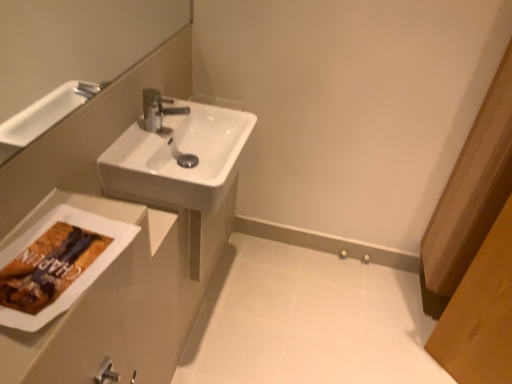
Find the location of a particular element. The width and height of the screenshot is (512, 384). white glossy porcelain at center is located at coordinates (307, 321).

What do you see at coordinates (307, 321) in the screenshot? I see `white glossy porcelain at center` at bounding box center [307, 321].

This screenshot has height=384, width=512. What do you see at coordinates (175, 159) in the screenshot? I see `white glossy sink at center` at bounding box center [175, 159].

Find the location of a particular element. white glossy sink at center is located at coordinates (175, 159).

I want to click on white glossy porcelain at center, so click(307, 321).

Is white glossy porcelain at center to the left of white glossy sink at center from the viewer's perspective?

No.

Is the position of white glossy porcelain at center more distant than that of white glossy sink at center?

Yes, white glossy porcelain at center is further from the camera.

Is point (225, 291) closer to camera compared to point (206, 126)?

No, (225, 291) is further to viewer.

From the image's perspective, between white glossy porcelain at center and white glossy sink at center, which one is located above?

From the image's view, white glossy sink at center is above.

From a real-world perspective, between white glossy porcelain at center and white glossy sink at center, who is vertically lower?

white glossy porcelain at center is physically lower.

Does white glossy porcelain at center have a greater width compared to white glossy sink at center?

Correct, the width of white glossy porcelain at center exceeds that of white glossy sink at center.

Does white glossy porcelain at center have a lesser height compared to white glossy sink at center?

Correct, white glossy porcelain at center is not as tall as white glossy sink at center.

Can you confirm if white glossy porcelain at center is smaller than white glossy sink at center?

Correct, white glossy porcelain at center occupies less space than white glossy sink at center.

From the picture: Would you say white glossy porcelain at center is outside white glossy sink at center?

white glossy porcelain at center is positioned outside white glossy sink at center.

Are white glossy porcelain at center and white glossy sink at center making contact?

There is a gap between white glossy porcelain at center and white glossy sink at center.

Is white glossy sink at center at the back of white glossy porcelain at center?

No, white glossy sink at center is not at the back of white glossy porcelain at center.

Can you tell me how much white glossy porcelain at center and white glossy sink at center differ in facing direction?

There is a 0.961-degree angle between the facing directions of white glossy porcelain at center and white glossy sink at center.

Measure the distance between white glossy porcelain at center and white glossy sink at center.

white glossy porcelain at center is 33.62 inches from white glossy sink at center.

Locate an element on the screen. porcelain directly beneath the white glossy sink at center (from a real-world perspective) is located at coordinates (307, 321).

Consider the image. Is white glossy sink at center to the left or to the right of white glossy porcelain at center in the image?

white glossy sink at center is to the left of white glossy porcelain at center.

Relative to white glossy porcelain at center, is white glossy sink at center in front or behind?

In the image, white glossy sink at center appears in front of white glossy porcelain at center.

Is point (135, 167) less distant than point (214, 286)?

Yes, point (135, 167) is in front of point (214, 286).

From the image's perspective, is white glossy sink at center beneath white glossy porcelain at center?

Incorrect, from the image's perspective, white glossy sink at center is higher than white glossy porcelain at center.

From a real-world perspective, is white glossy sink at center positioned over white glossy porcelain at center based on gravity?

Indeed, from a real-world perspective, white glossy sink at center stands above white glossy porcelain at center.

Does white glossy sink at center have a lesser width compared to white glossy porcelain at center?

Correct, the width of white glossy sink at center is less than that of white glossy porcelain at center.

Can you confirm if white glossy sink at center is taller than white glossy porcelain at center?

Correct, white glossy sink at center is much taller as white glossy porcelain at center.

Considering the relative sizes of white glossy sink at center and white glossy porcelain at center in the image provided, is white glossy sink at center bigger than white glossy porcelain at center?

Indeed, white glossy sink at center has a larger size compared to white glossy porcelain at center.

Is white glossy sink at center surrounding white glossy porcelain at center?

No.

Is white glossy sink at center directly adjacent to white glossy porcelain at center?

No, white glossy sink at center is not touching white glossy porcelain at center.

Is white glossy sink at center aimed at white glossy porcelain at center?

No, white glossy sink at center is not aimed at white glossy porcelain at center.

What are the coordinates of `sink on the left of white glossy porcelain at center` in the screenshot? It's located at (175, 159).

You are a GUI agent. You are given a task and a screenshot of the screen. Output one action in this format:
    pyautogui.click(x=<x>, y=<y>)
    Task: Click on the sink above the white glossy porcelain at center (from a real-world perspective)
    The width and height of the screenshot is (512, 384).
    Given the screenshot: What is the action you would take?
    pyautogui.click(x=175, y=159)

Image resolution: width=512 pixels, height=384 pixels. I want to click on porcelain lying behind the white glossy sink at center, so click(x=307, y=321).